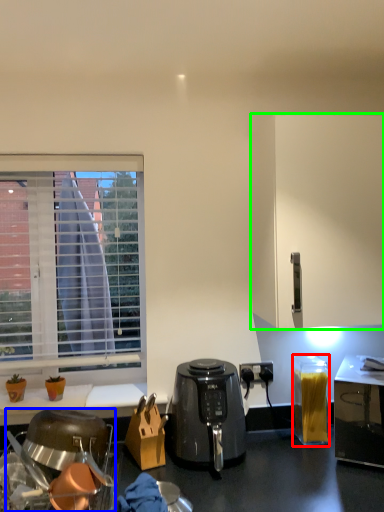
Question: Which object is the farthest from appliance (highlighted by a red box)? Choose among these: kitchen appliance (highlighted by a blue box) or cabinetry (highlighted by a green box).

Choices:
 (A) kitchen appliance
 (B) cabinetry

Answer: (A)